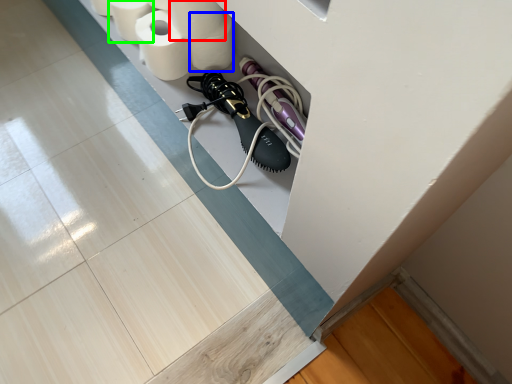
Question: Which object is the closest to the toilet paper (highlighted by a red box)? Choose among these: toilet paper (highlighted by a blue box) or toilet paper (highlighted by a green box).

Choices:
 (A) toilet paper
 (B) toilet paper

Answer: (A)